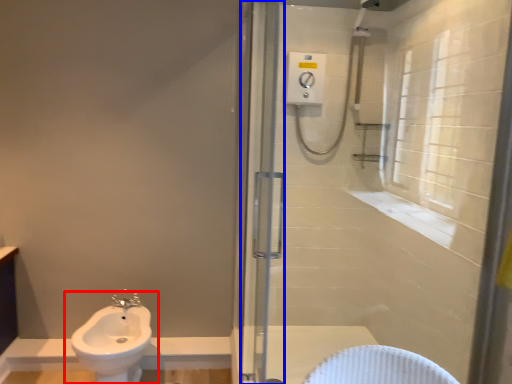
Question: Which object is closer to the camera taking this photo, sink (highlighted by a red box) or screen door (highlighted by a blue box)?

Choices:
 (A) sink
 (B) screen door

Answer: (B)